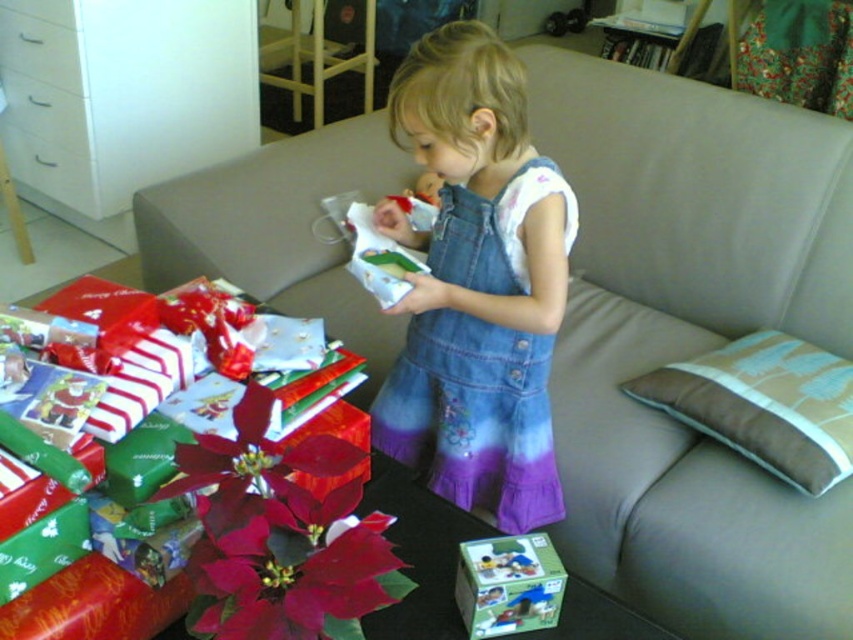
Question: Does denim dress at center come behind green cardboard box at lower center?

Choices:
 (A) no
 (B) yes

Answer: (B)

Question: Among these points, which one is nearest to the camera?

Choices:
 (A) (468, 348)
 (B) (521, 588)

Answer: (B)

Question: Which of the following is the farthest from the observer?

Choices:
 (A) (427, 342)
 (B) (465, 552)

Answer: (A)

Question: Does denim dress at center have a lesser width compared to green cardboard box at lower center?

Choices:
 (A) no
 (B) yes

Answer: (A)

Question: Does denim dress at center appear over green cardboard box at lower center?

Choices:
 (A) no
 (B) yes

Answer: (B)